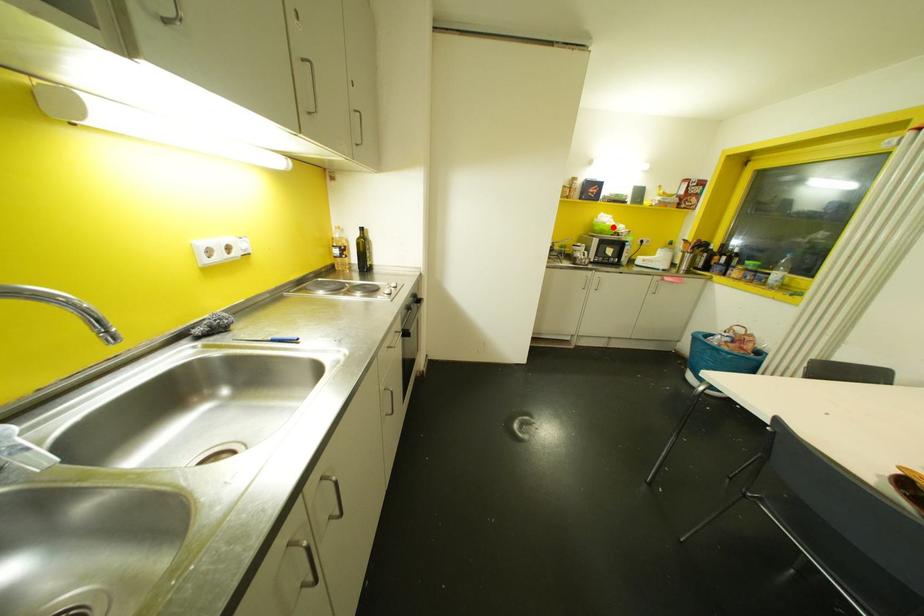
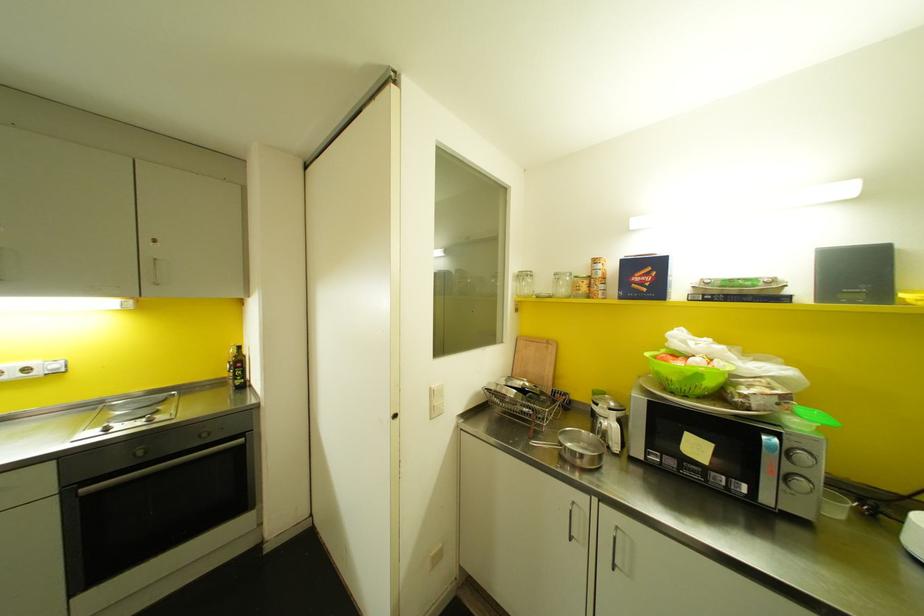
Question: I am providing you with two images of the same scene from different viewpoints. A red point is marked on the first image. Can you still see the location of the red point in image 2?

Choices:
 (A) Yes
 (B) No

Answer: (A)